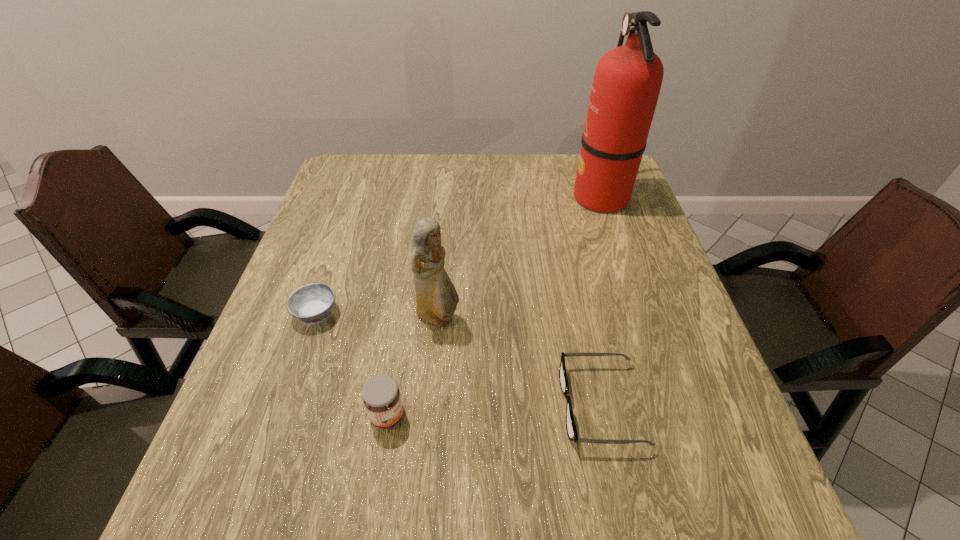
This screenshot has height=540, width=960. I want to click on free space at the far edge of the desktop, so click(557, 173).

Identify the location of vacant space at the near edge of the desktop. (528, 506).

The image size is (960, 540). In order to click on vacant space at the left edge in this screenshot , I will do `click(297, 402)`.

The width and height of the screenshot is (960, 540). In order to click on free region at the right edge of the desktop in this screenshot , I will do `click(634, 215)`.

Where is `free spot at the far left corner of the desktop`? Image resolution: width=960 pixels, height=540 pixels. free spot at the far left corner of the desktop is located at coordinates (342, 168).

Identify the location of vacant point located between the leftmost object and the spectacles. This screenshot has height=540, width=960. (458, 359).

In order to click on vacant space in between the leftmost object and the third tallest object in this screenshot , I will do pyautogui.click(x=352, y=364).

Locate an element on the screen. vacant space in between the ashtray and the jam is located at coordinates (352, 364).

Find the location of a particular element. The width and height of the screenshot is (960, 540). unoccupied area between the jam and the ashtray is located at coordinates pyautogui.click(x=352, y=364).

Find the location of a particular element. This screenshot has height=540, width=960. vacant area that lies between the third tallest object and the spectacles is located at coordinates (493, 410).